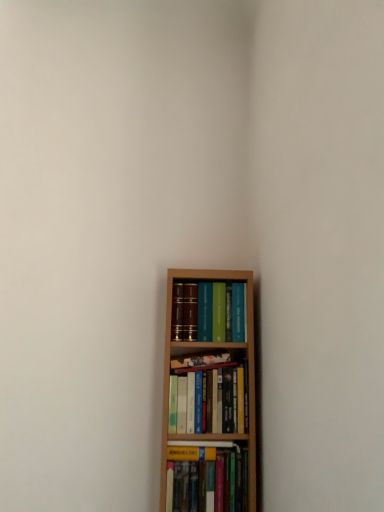
Image resolution: width=384 pixels, height=512 pixels. Describe the element at coordinates (200, 361) in the screenshot. I see `hardcover book at center, which ranks as the 3th book in bottom-to-top order` at that location.

The width and height of the screenshot is (384, 512). Find the location of `hardcover book at center, which ranks as the 3th book in bottom-to-top order`. hardcover book at center, which ranks as the 3th book in bottom-to-top order is located at coordinates (200, 361).

Identify the location of matte hardcover books at center, the fourth book in the bottom-to-top sequence. (208, 312).

Where is `hardcover book at center, which ranks as the 3th book in bottom-to-top order`? The image size is (384, 512). hardcover book at center, which ranks as the 3th book in bottom-to-top order is located at coordinates (200, 361).

Can you confirm if hardcover book at center, which is the 2th book in top-to-bottom order, is taller than matte hardcover books at center, the fourth book in the bottom-to-top sequence?

Incorrect, the height of hardcover book at center, which is the 2th book in top-to-bottom order, is not larger of that of matte hardcover books at center, the fourth book in the bottom-to-top sequence.

Which point is more forward, (230, 360) or (207, 332)?

The point (207, 332) is closer to the camera.

This screenshot has height=512, width=384. What are the coordinates of `book that is the 1st object directly below the matte hardcover books at center, marked as the first book in a top-to-bottom arrangement (from a real-world perspective)` in the screenshot? It's located at (200, 361).

Between hardcover book at center, which is the 2th book in top-to-bottom order, and matte hardcover books at center, marked as the first book in a top-to-bottom arrangement, which one has smaller size?

hardcover book at center, which is the 2th book in top-to-bottom order.

Is point (220, 360) closer or farther from the camera than point (193, 468)?

Point (220, 360) appears to be farther away from the viewer than point (193, 468).

Is hardcover book at center, which ranks as the 3th book in bottom-to-top order, far from hardcover book at lower center, the 4th book viewed from the top?

No, hardcover book at center, which ranks as the 3th book in bottom-to-top order, is not far away from hardcover book at lower center, the 4th book viewed from the top.

Which object is positioned more to the left, hardcover book at center, which ranks as the 3th book in bottom-to-top order, or hardcover book at lower center, which is the 1th book in bottom-to-top order?

hardcover book at center, which ranks as the 3th book in bottom-to-top order.

From a real-world perspective, is hardcover book at center, which is the 2th book in top-to-bottom order, located higher than hardcover book at lower center, which is the 1th book in bottom-to-top order?

Yes, from a real-world perspective, hardcover book at center, which is the 2th book in top-to-bottom order, is above hardcover book at lower center, which is the 1th book in bottom-to-top order.

Who is taller, hardcover book at lower center, the 4th book viewed from the top, or matte hardcover books at center, marked as the first book in a top-to-bottom arrangement?

matte hardcover books at center, marked as the first book in a top-to-bottom arrangement.

Is matte hardcover books at center, marked as the first book in a top-to-bottom arrangement, inside hardcover book at lower center, the 4th book viewed from the top?

No, matte hardcover books at center, marked as the first book in a top-to-bottom arrangement, is not a part of hardcover book at lower center, the 4th book viewed from the top.

Image resolution: width=384 pixels, height=512 pixels. Identify the location of book that is the 2nd object to the left of the matte hardcover books at center, marked as the first book in a top-to-bottom arrangement, starting at the anchor. (206, 479).

Is hardcover book at lower center, the 4th book viewed from the top, positioned with its back to matte hardcover books at center, the fourth book in the bottom-to-top sequence?

No, hardcover book at lower center, the 4th book viewed from the top,'s orientation is not away from matte hardcover books at center, the fourth book in the bottom-to-top sequence.

Looking at this image, is hardcover book at lower center, which is the 1th book in bottom-to-top order, bigger than hardcover books at center, arranged as the 2th book when ordered from the bottom?

Actually, hardcover book at lower center, which is the 1th book in bottom-to-top order, might be smaller than hardcover books at center, arranged as the 2th book when ordered from the bottom.

Which object is thinner, hardcover book at lower center, the 4th book viewed from the top, or hardcover books at center, arranged as the 2th book when ordered from the bottom?

hardcover books at center, arranged as the 2th book when ordered from the bottom, is thinner.

How much distance is there between hardcover book at lower center, which is the 1th book in bottom-to-top order, and hardcover books at center, arranged as the third book when viewed from the top?

hardcover book at lower center, which is the 1th book in bottom-to-top order, is 6.10 inches away from hardcover books at center, arranged as the third book when viewed from the top.

From the image's perspective, between hardcover book at lower center, the 4th book viewed from the top, and hardcover books at center, arranged as the 2th book when ordered from the bottom, who is located below?

hardcover book at lower center, the 4th book viewed from the top, appears lower in the image.

From the image's perspective, would you say hardcover book at center, which is the 2th book in top-to-bottom order, is shown under hardcover books at center, arranged as the 2th book when ordered from the bottom?

No, from the image's perspective, hardcover book at center, which is the 2th book in top-to-bottom order, is not below hardcover books at center, arranged as the 2th book when ordered from the bottom.

Is hardcover book at center, which is the 2th book in top-to-bottom order, facing towards hardcover books at center, arranged as the 2th book when ordered from the bottom?

No.

Which is more to the left, hardcover book at center, which ranks as the 3th book in bottom-to-top order, or hardcover books at center, arranged as the 2th book when ordered from the bottom?

hardcover book at center, which ranks as the 3th book in bottom-to-top order, is more to the left.

Based on the photo, considering the sizes of objects hardcover book at center, which ranks as the 3th book in bottom-to-top order, and hardcover books at center, arranged as the 2th book when ordered from the bottom, in the image provided, who is shorter, hardcover book at center, which ranks as the 3th book in bottom-to-top order, or hardcover books at center, arranged as the 2th book when ordered from the bottom,?

hardcover book at center, which ranks as the 3th book in bottom-to-top order, is shorter.

How different are the orientations of hardcover books at center, arranged as the 2th book when ordered from the bottom, and hardcover book at lower center, the 4th book viewed from the top, in degrees?

hardcover books at center, arranged as the 2th book when ordered from the bottom, and hardcover book at lower center, the 4th book viewed from the top, are facing 0.00341 degrees away from each other.

Considering the sizes of hardcover books at center, arranged as the third book when viewed from the top, and hardcover book at lower center, which is the 1th book in bottom-to-top order, in the image, is hardcover books at center, arranged as the third book when viewed from the top, wider or thinner than hardcover book at lower center, which is the 1th book in bottom-to-top order,?

hardcover books at center, arranged as the third book when viewed from the top, is thinner than hardcover book at lower center, which is the 1th book in bottom-to-top order.

Which object is closer to the camera taking this photo, hardcover books at center, arranged as the third book when viewed from the top, or hardcover book at lower center, the 4th book viewed from the top?

hardcover book at lower center, the 4th book viewed from the top.

At what (x,y) coordinates should I click in order to perform the action: click on the 1st book behind the hardcover book at lower center, which is the 1th book in bottom-to-top order. Please return your answer as a coordinate pair (x, y). Image resolution: width=384 pixels, height=512 pixels. Looking at the image, I should click on tap(211, 394).

Considering the sizes of matte hardcover books at center, marked as the first book in a top-to-bottom arrangement, and hardcover book at center, which ranks as the 3th book in bottom-to-top order, in the image, is matte hardcover books at center, marked as the first book in a top-to-bottom arrangement, bigger or smaller than hardcover book at center, which ranks as the 3th book in bottom-to-top order,?

Clearly, matte hardcover books at center, marked as the first book in a top-to-bottom arrangement, is larger in size than hardcover book at center, which ranks as the 3th book in bottom-to-top order.

Is matte hardcover books at center, marked as the first book in a top-to-bottom arrangement, far from hardcover book at center, which is the 2th book in top-to-bottom order?

No, there isn't a large distance between matte hardcover books at center, marked as the first book in a top-to-bottom arrangement, and hardcover book at center, which is the 2th book in top-to-bottom order.

Is matte hardcover books at center, marked as the first book in a top-to-bottom arrangement, spatially inside hardcover book at center, which is the 2th book in top-to-bottom order, or outside of it?

matte hardcover books at center, marked as the first book in a top-to-bottom arrangement, is not enclosed by hardcover book at center, which is the 2th book in top-to-bottom order.

Locate an element on the screen. This screenshot has height=512, width=384. the 1st book directly beneath the matte hardcover books at center, marked as the first book in a top-to-bottom arrangement (from a real-world perspective) is located at coordinates (200, 361).

From a real-world perspective, which book is the 2nd one above the hardcover book at lower center, the 4th book viewed from the top? Please provide its 2D coordinates.

[(200, 361)]

Which object lies nearer to the anchor point hardcover book at center, which ranks as the 3th book in bottom-to-top order, hardcover books at center, arranged as the 2th book when ordered from the bottom, or hardcover book at lower center, the 4th book viewed from the top?

hardcover books at center, arranged as the 2th book when ordered from the bottom.

When comparing their distances from hardcover books at center, arranged as the 2th book when ordered from the bottom, does matte hardcover books at center, the fourth book in the bottom-to-top sequence, or hardcover book at lower center, the 4th book viewed from the top, seem further?

hardcover book at lower center, the 4th book viewed from the top.

From the image, which object appears to be farther from hardcover book at center, which ranks as the 3th book in bottom-to-top order, hardcover books at center, arranged as the third book when viewed from the top, or matte hardcover books at center, the fourth book in the bottom-to-top sequence?

matte hardcover books at center, the fourth book in the bottom-to-top sequence, is further to hardcover book at center, which ranks as the 3th book in bottom-to-top order.

Looking at the image, which one is located closer to matte hardcover books at center, marked as the first book in a top-to-bottom arrangement, hardcover books at center, arranged as the third book when viewed from the top, or hardcover book at lower center, which is the 1th book in bottom-to-top order?

hardcover books at center, arranged as the third book when viewed from the top, is positioned closer to the anchor matte hardcover books at center, marked as the first book in a top-to-bottom arrangement.

Considering their positions, is hardcover book at center, which ranks as the 3th book in bottom-to-top order, positioned closer to matte hardcover books at center, the fourth book in the bottom-to-top sequence, than hardcover books at center, arranged as the 2th book when ordered from the bottom?

hardcover book at center, which ranks as the 3th book in bottom-to-top order, lies closer to matte hardcover books at center, the fourth book in the bottom-to-top sequence, than the other object.

Considering their positions, is hardcover book at center, which is the 2th book in top-to-bottom order, positioned further to hardcover book at lower center, the 4th book viewed from the top, than matte hardcover books at center, marked as the first book in a top-to-bottom arrangement?

matte hardcover books at center, marked as the first book in a top-to-bottom arrangement.

When comparing their distances from hardcover book at center, which ranks as the 3th book in bottom-to-top order, does matte hardcover books at center, the fourth book in the bottom-to-top sequence, or hardcover book at lower center, which is the 1th book in bottom-to-top order, seem closer?

matte hardcover books at center, the fourth book in the bottom-to-top sequence, lies closer to hardcover book at center, which ranks as the 3th book in bottom-to-top order, than the other object.

From the image, which object appears to be nearer to hardcover books at center, arranged as the 2th book when ordered from the bottom, hardcover book at center, which ranks as the 3th book in bottom-to-top order, or hardcover book at lower center, which is the 1th book in bottom-to-top order?

hardcover book at center, which ranks as the 3th book in bottom-to-top order, is positioned closer to the anchor hardcover books at center, arranged as the 2th book when ordered from the bottom.

Where is `book between hardcover book at center, which ranks as the 3th book in bottom-to-top order, and hardcover book at lower center, which is the 1th book in bottom-to-top order, in the up-down direction`? The height and width of the screenshot is (512, 384). book between hardcover book at center, which ranks as the 3th book in bottom-to-top order, and hardcover book at lower center, which is the 1th book in bottom-to-top order, in the up-down direction is located at coordinates (211, 394).

I want to click on book between matte hardcover books at center, the fourth book in the bottom-to-top sequence, and hardcover books at center, arranged as the 2th book when ordered from the bottom, in the vertical direction, so click(200, 361).